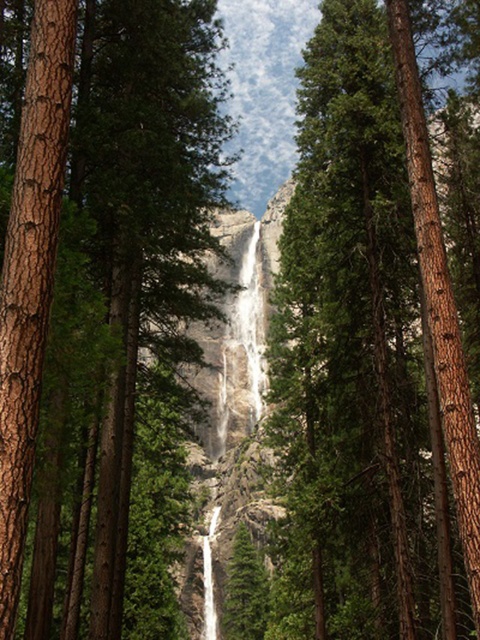
Question: Which of the following is the farthest from the observer?

Choices:
 (A) (408, 257)
 (B) (72, 429)

Answer: (A)

Question: Considering the relative positions of brown rough bark tree at center and green rough bark tree at center in the image provided, where is brown rough bark tree at center located with respect to green rough bark tree at center?

Choices:
 (A) right
 (B) left

Answer: (B)

Question: Is brown rough bark tree at center below green rough bark tree at center?

Choices:
 (A) yes
 (B) no

Answer: (B)

Question: Does brown rough bark tree at center have a lesser width compared to green rough bark tree at center?

Choices:
 (A) no
 (B) yes

Answer: (A)